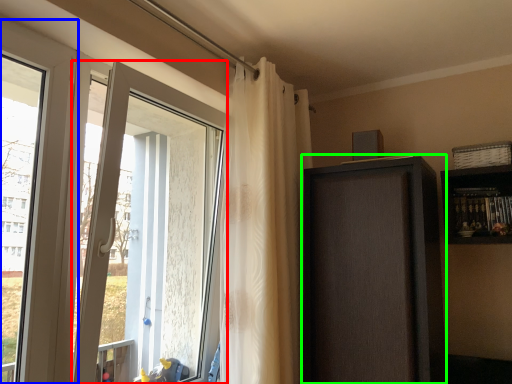
Question: Which object is the farthest from door (highlighted by a red box)? Choose among these: window (highlighted by a blue box) or screen door (highlighted by a green box).

Choices:
 (A) window
 (B) screen door

Answer: (B)